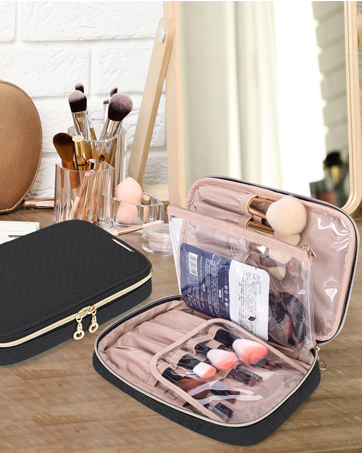
This screenshot has height=453, width=362. In order to click on glass storage containers in this screenshot , I will do `click(101, 148)`, `click(84, 185)`, `click(132, 217)`, `click(166, 238)`.